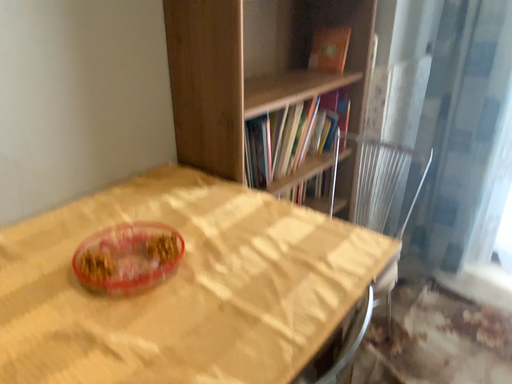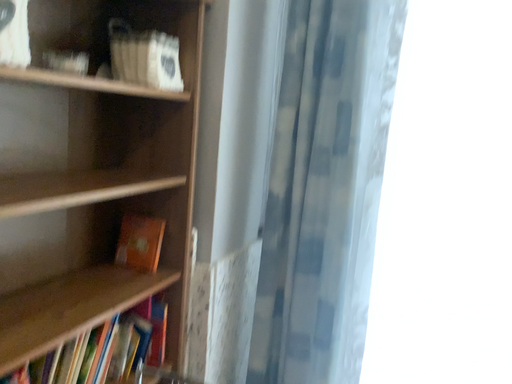
Question: Which way did the camera rotate in the video?

Choices:
 (A) rotated upward
 (B) rotated downward

Answer: (A)